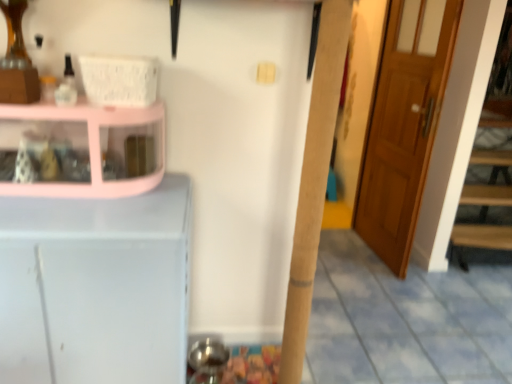
Describe the element at coordinates (404, 125) in the screenshot. The height and width of the screenshot is (384, 512). I see `wooden door at right` at that location.

Image resolution: width=512 pixels, height=384 pixels. What are the coordinates of `pink glossy cabinet at left` in the screenshot? It's located at (81, 150).

Which is correct: pink glossy cabinet at left is inside white matte cabinet at left, or outside of it?

pink glossy cabinet at left cannot be found inside white matte cabinet at left.

Based on their sizes in the image, would you say pink glossy cabinet at left is bigger or smaller than white matte cabinet at left?

In the image, pink glossy cabinet at left appears to be smaller than white matte cabinet at left.

Is pink glossy cabinet at left not near white matte cabinet at left?

That's not correct — pink glossy cabinet at left is a little close to white matte cabinet at left.

Measure the distance between pink glossy cabinet at left and white matte cabinet at left.

28.92 centimeters.

From a real-world perspective, who is located lower, wooden door at right or pink glossy cabinet at left?

In real-world perspective, wooden door at right is lower.

From the image's perspective, which object appears higher, wooden door at right or pink glossy cabinet at left?

wooden door at right.

Is wooden door at right inside or outside of pink glossy cabinet at left?

wooden door at right is located beyond the bounds of pink glossy cabinet at left.

Is the position of wooden door at right less distant than that of pink glossy cabinet at left?

No, wooden door at right is behind pink glossy cabinet at left.

In the scene shown: From a real-world perspective, is pink glossy cabinet at left located beneath wooden door at right?

No, from a real-world perspective, pink glossy cabinet at left is not beneath wooden door at right.

Is pink glossy cabinet at left facing away from wooden door at right?

No, pink glossy cabinet at left is not facing the opposite direction of wooden door at right.

Are pink glossy cabinet at left and wooden door at right far apart?

pink glossy cabinet at left is positioned a significant distance from wooden door at right.

Is pink glossy cabinet at left bigger or smaller than wooden door at right?

→ pink glossy cabinet at left is smaller than wooden door at right.

Is white matte cabinet at left behind wooden door at right?

No, white matte cabinet at left is closer to the camera.

Considering the sizes of objects white matte cabinet at left and wooden door at right in the image provided, who is shorter, white matte cabinet at left or wooden door at right?

Standing shorter between the two is white matte cabinet at left.

Would you consider white matte cabinet at left to be distant from wooden door at right?

Indeed, white matte cabinet at left is not near wooden door at right.

Consider the image. Considering the sizes of objects white matte cabinet at left and wooden door at right in the image provided, who is thinner, white matte cabinet at left or wooden door at right?

With smaller width is wooden door at right.

Is wooden door at right positioned before white matte cabinet at left?

No, wooden door at right is further to the viewer.

Is wooden door at right aimed at white matte cabinet at left?

No.

Are wooden door at right and white matte cabinet at left far apart?

That's right, there is a large distance between wooden door at right and white matte cabinet at left.

Is point (111, 311) positioned in front of point (150, 138)?

Yes, point (111, 311) is closer to viewer.

Considering the positions of objects white matte cabinet at left and pink glossy cabinet at left in the image provided, who is in front, white matte cabinet at left or pink glossy cabinet at left?

white matte cabinet at left is closer to the camera.

Is white matte cabinet at left positioned far away from pink glossy cabinet at left?

That's not correct — white matte cabinet at left is a little close to pink glossy cabinet at left.

Which of these two, white matte cabinet at left or pink glossy cabinet at left, is wider?

white matte cabinet at left is wider.

The width and height of the screenshot is (512, 384). I want to click on shelf behind the white matte cabinet at left, so click(x=81, y=150).

This screenshot has width=512, height=384. What are the coordinates of `door directly beneath the pink glossy cabinet at left (from a real-world perspective)` in the screenshot? It's located at (404, 125).

Based on their spatial positions, is pink glossy cabinet at left or white matte cabinet at left further from wooden door at right?

white matte cabinet at left is further to wooden door at right.

Estimate the real-world distances between objects in this image. Which object is closer to pink glossy cabinet at left, wooden door at right or white matte cabinet at left?

white matte cabinet at left.

When comparing their distances from pink glossy cabinet at left, does white matte cabinet at left or wooden door at right seem further?

wooden door at right is further to pink glossy cabinet at left.

Based on their spatial positions, is wooden door at right or pink glossy cabinet at left further from white matte cabinet at left?

wooden door at right.

Estimate the real-world distances between objects in this image. Which object is further from white matte cabinet at left, pink glossy cabinet at left or wooden door at right?

wooden door at right.

When comparing their distances from wooden door at right, does white matte cabinet at left or pink glossy cabinet at left seem closer?

pink glossy cabinet at left is closer to wooden door at right.

Locate an element on the screen. Image resolution: width=512 pixels, height=384 pixels. shelf situated between white matte cabinet at left and wooden door at right from left to right is located at coordinates (81, 150).